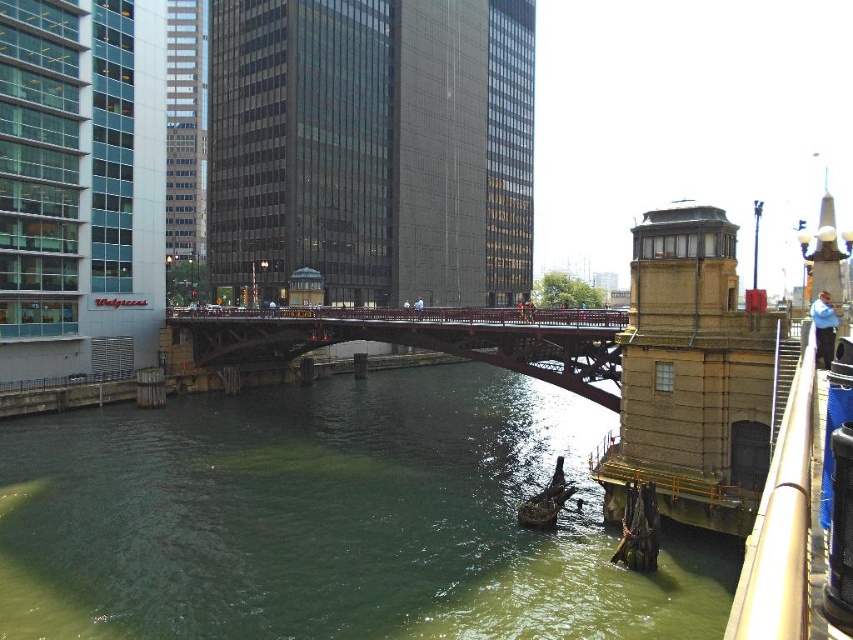
You are a city planner analyzing the layout of this urban area. The red painted steel bridge at center is crucial for traffic flow. Can you determine its exact location on the grid system using coordinates?

The red painted steel bridge at center is located at coordinates point (422, 339).

You are standing on the bridge and want to take a photo of the green murky water at center. Where should you point your camera?

You should point your camera towards the center of the bridge at coordinates point (x=329, y=518) to capture the green murky water at center.

You are a drone operator who needs to fly a drone from your current position to take aerial shots of the red painted steel bridge at center. The drone has a maximum flight range of 30 meters. Based on the scene, will the drone be able to reach the bridge?

The distance between the red painted steel bridge at center and the camera is 32.40 meters. Since the drone can only fly up to 30 meters, it will not be able to reach the bridge.